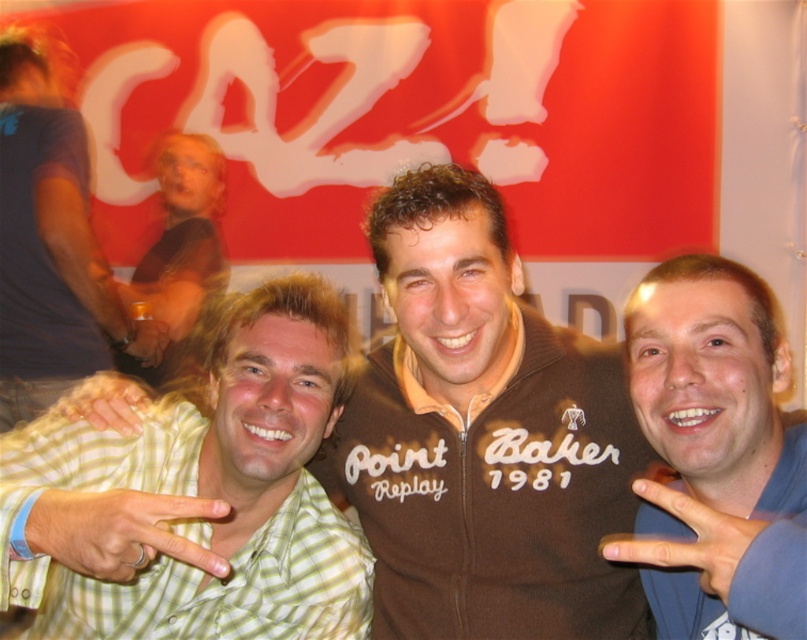
Can you confirm if blue cotton shirt at right is positioned to the left of green striped shirt at lower left?

No, blue cotton shirt at right is not to the left of green striped shirt at lower left.

Is blue cotton shirt at right below green striped shirt at lower left?

Correct, blue cotton shirt at right is located below green striped shirt at lower left.

Does point (647, 385) come farther from viewer compared to point (130, 388)?

No, (647, 385) is in front of (130, 388).

The width and height of the screenshot is (807, 640). I want to click on blue cotton shirt at right, so click(x=714, y=456).

Is blue cotton shirt at right thinner than light brown hair at left?

Correct, blue cotton shirt at right's width is less than light brown hair at left's.

Is point (705, 349) positioned behind point (24, 275)?

No, (705, 349) is in front of (24, 275).

This screenshot has height=640, width=807. What are the coordinates of `blue cotton shirt at right` in the screenshot? It's located at (714, 456).

Does green checkered shirt at center have a greater width compared to green striped shirt at lower left?

Indeed, green checkered shirt at center has a greater width compared to green striped shirt at lower left.

Does green checkered shirt at center come in front of green striped shirt at lower left?

Yes.

Is point (82, 634) farther from camera compared to point (139, 408)?

No, it is in front of (139, 408).

In order to click on green checkered shirt at center in this screenshot , I will do `click(197, 497)`.